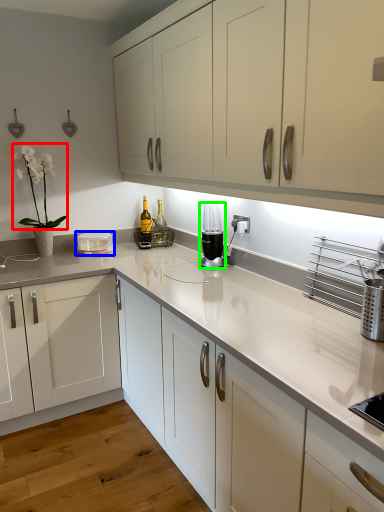
Question: Which object is the closest to the plant (highlighted by a red box)? Choose among these: appliance (highlighted by a blue box) or home appliance (highlighted by a green box).

Choices:
 (A) appliance
 (B) home appliance

Answer: (A)